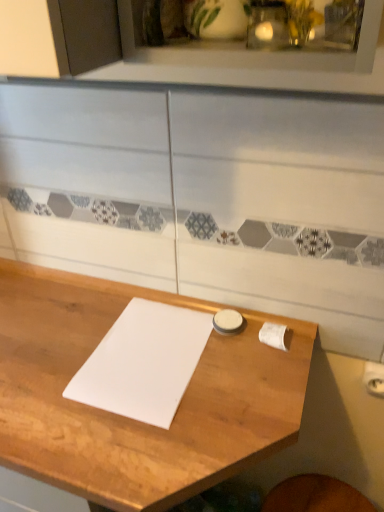
I want to click on free spot to the right of white matte journal at center, so click(x=246, y=370).